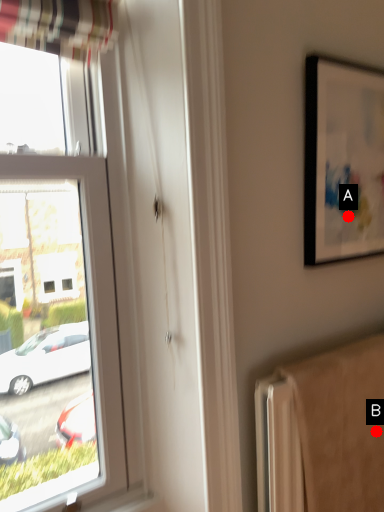
Question: Two points are circled on the image, labeled by A and B beside each circle. Which point appears farthest from the camera in this image?

Choices:
 (A) A is further
 (B) B is further

Answer: (A)